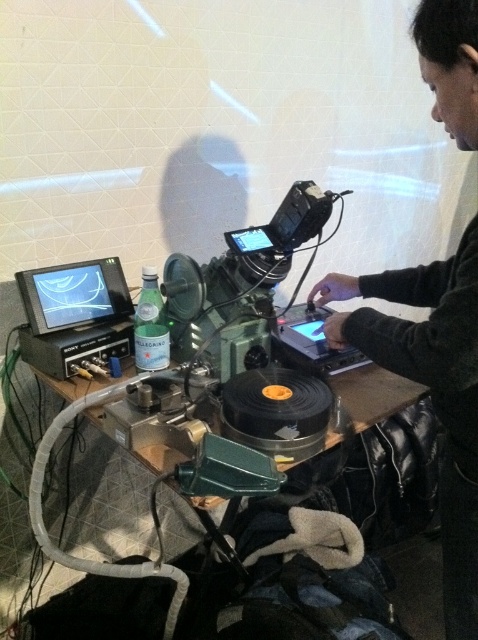
Question: Which point appears farthest from the camera in this image?

Choices:
 (A) (447, 456)
 (B) (232, 355)

Answer: (B)

Question: Is dark gray sweater at center to the left of wooden table at center from the viewer's perspective?

Choices:
 (A) yes
 (B) no

Answer: (B)

Question: Among these points, which one is farthest from the camera?

Choices:
 (A) (359, 420)
 (B) (333, 282)

Answer: (B)

Question: Which object is closer to the camera taking this photo?

Choices:
 (A) wooden table at center
 (B) dark gray sweater at center

Answer: (B)

Question: From the image, what is the correct spatial relationship of dark gray sweater at center in relation to wooden table at center?

Choices:
 (A) above
 (B) below

Answer: (A)

Question: Is dark gray sweater at center to the right of wooden table at center from the viewer's perspective?

Choices:
 (A) no
 (B) yes

Answer: (B)